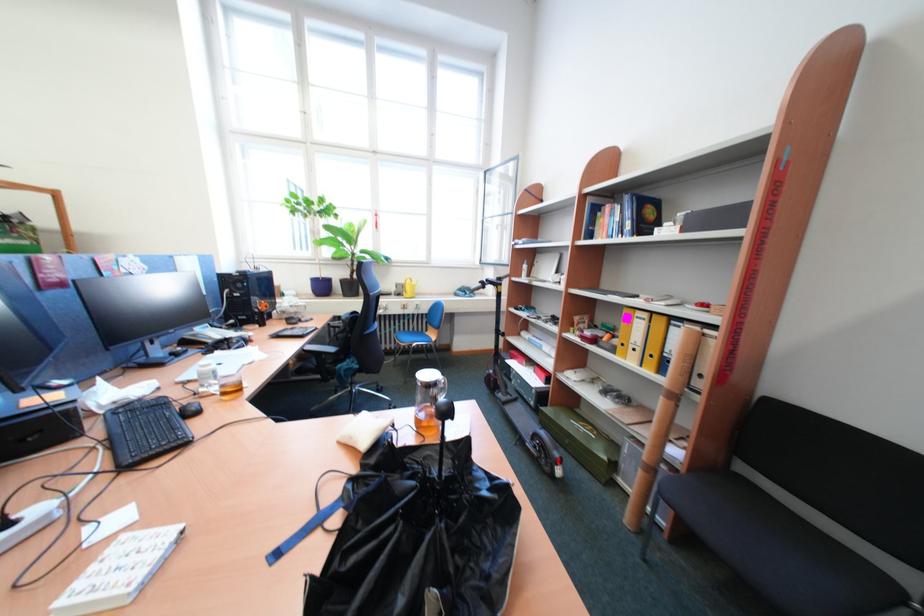
Describe the element at coordinates (493, 277) in the screenshot. I see `a scooter handlebar` at that location.